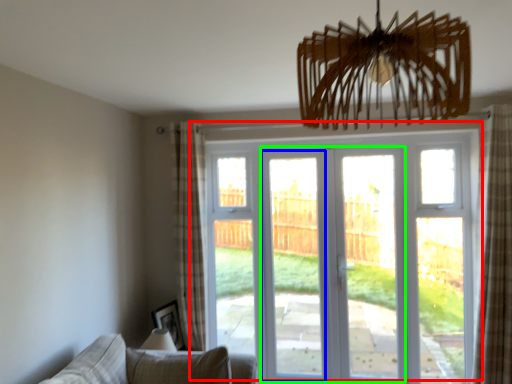
Question: Considering the real-world distances, which object is farthest from door (highlighted by a red box)? screen door (highlighted by a blue box) or screen door (highlighted by a green box)?

Choices:
 (A) screen door
 (B) screen door

Answer: (B)